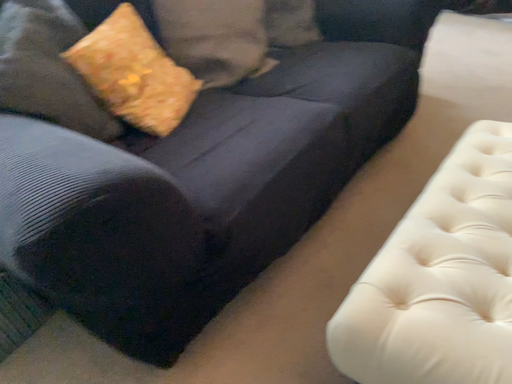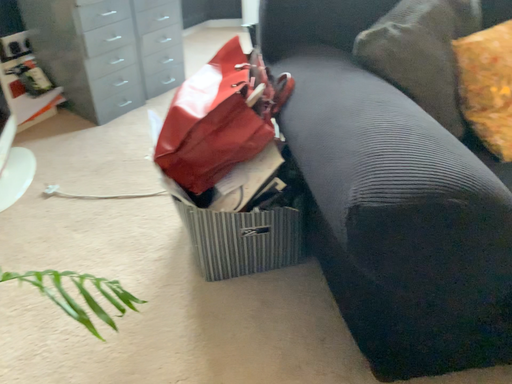
Question: How did the camera likely rotate when shooting the video?

Choices:
 (A) rotated upward
 (B) rotated downward

Answer: (A)